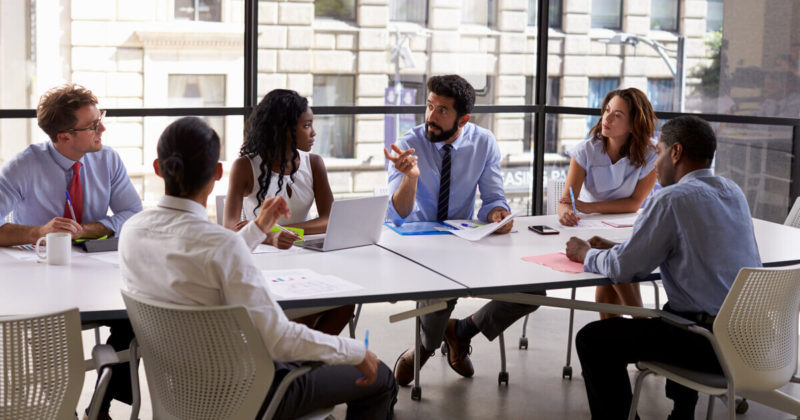
Image resolution: width=800 pixels, height=420 pixels. I want to click on window panes, so click(153, 54), click(132, 130), click(332, 40), click(354, 143), click(774, 161), click(710, 86).